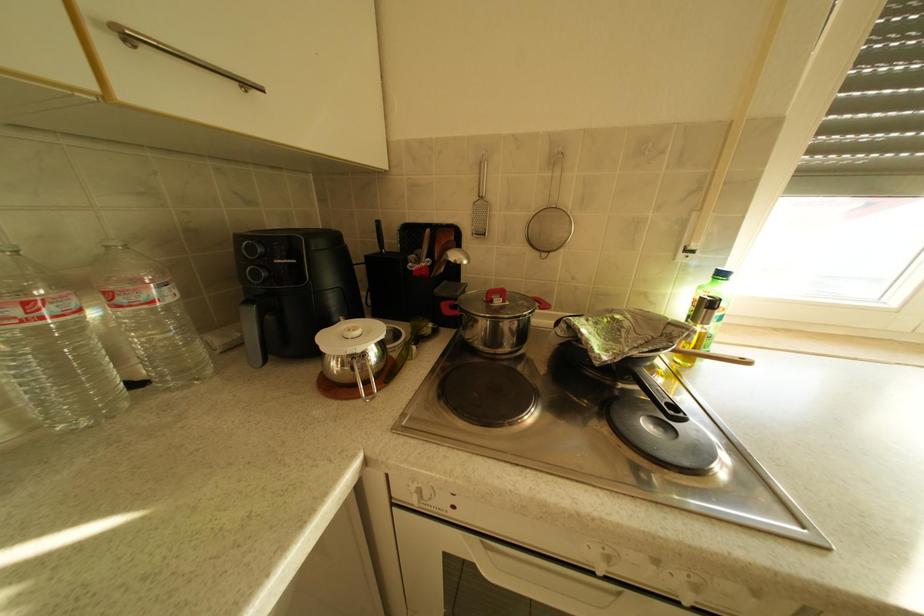
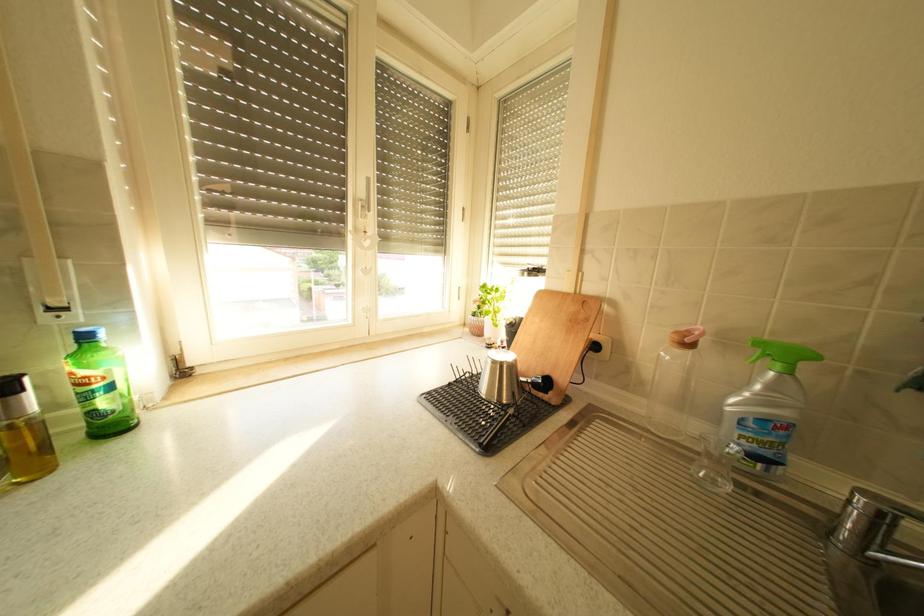
Question: The camera is either moving clockwise (left) or counter-clockwise (right) around the object. The first image is from the beginning of the video and the second image is from the end. Is the camera moving left or right when shooting the video?

Choices:
 (A) Left
 (B) Right

Answer: (A)